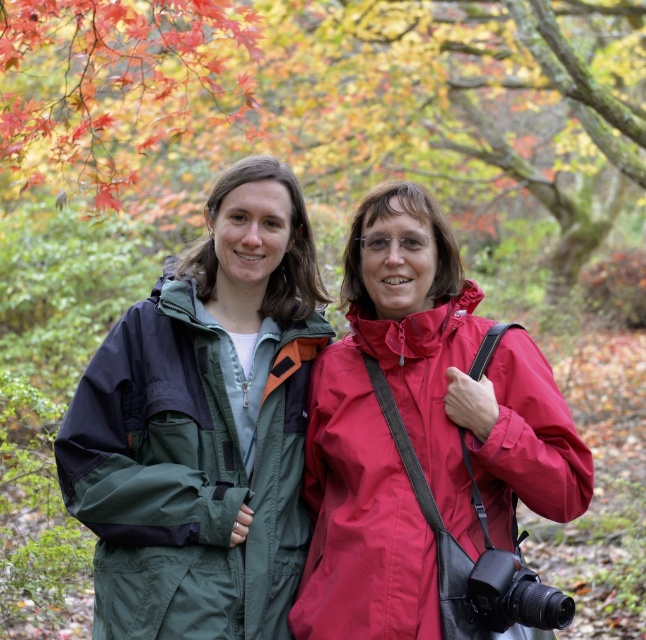
Is point (497, 388) positioned after point (236, 468)?

No, (497, 388) is in front of (236, 468).

Which of these two, matte red jacket at center or green fabric jacket at center, stands taller?

Standing taller between the two is matte red jacket at center.

Is point (466, 365) positioned behind point (271, 548)?

No, (466, 365) is closer to viewer.

Where is `matte red jacket at center`? matte red jacket at center is located at coordinates (422, 440).